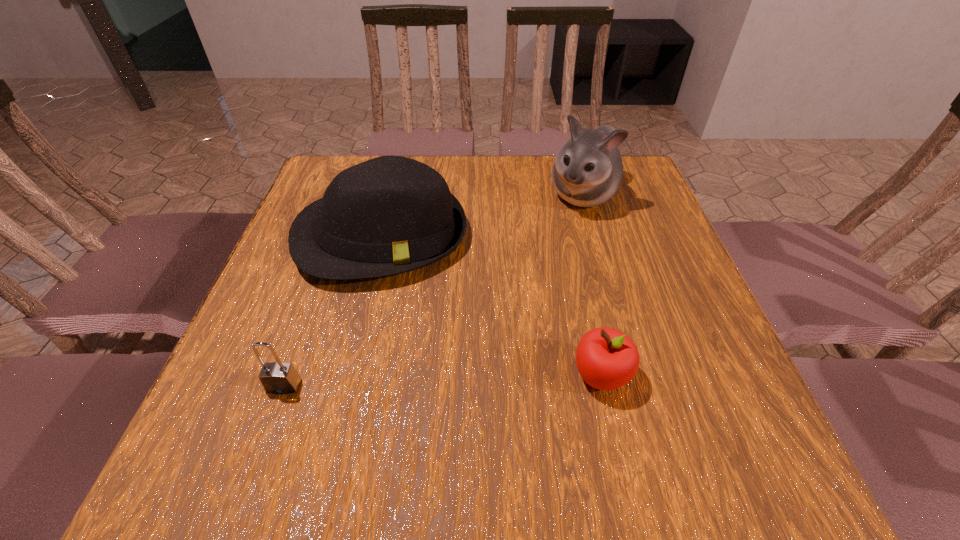
Locate an element on the screen. The image size is (960, 540). vacant space that is in between the padlock and the apple is located at coordinates coord(443,380).

Locate an element on the screen. The width and height of the screenshot is (960, 540). free spot between the hamster and the padlock is located at coordinates pyautogui.click(x=433, y=291).

The height and width of the screenshot is (540, 960). What are the coordinates of `vacant space that is in between the tallest object and the fedora` in the screenshot? It's located at (482, 215).

Find the location of a particular element. The image size is (960, 540). unoccupied area between the apple and the hamster is located at coordinates (592, 285).

The width and height of the screenshot is (960, 540). In order to click on free space between the padlock and the apple in this screenshot , I will do `click(443, 380)`.

This screenshot has width=960, height=540. Identify the location of object that is the third closest to the apple. (278, 377).

Locate which object ranks third in proximity to the hamster. Please provide its 2D coordinates. Your answer should be formatted as a tuple, i.e. [(x, y)], where the tuple contains the x and y coordinates of a point satisfying the conditions above.

[(278, 377)]

This screenshot has height=540, width=960. I want to click on free point that satisfies the following two spatial constraints: 1. on the front side of the third shortest object; 2. on the left side of the apple, so click(347, 375).